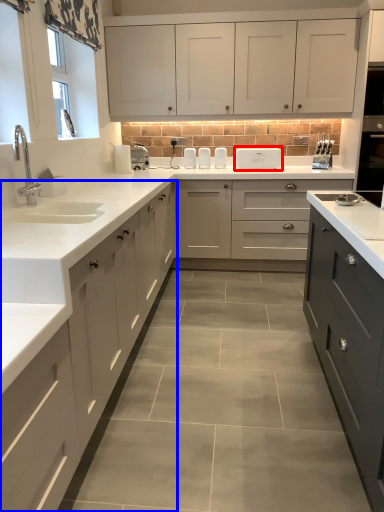
Question: Among these objects, which one is farthest to the camera, appliance (highlighted by a red box) or cabinetry (highlighted by a blue box)?

Choices:
 (A) appliance
 (B) cabinetry

Answer: (A)